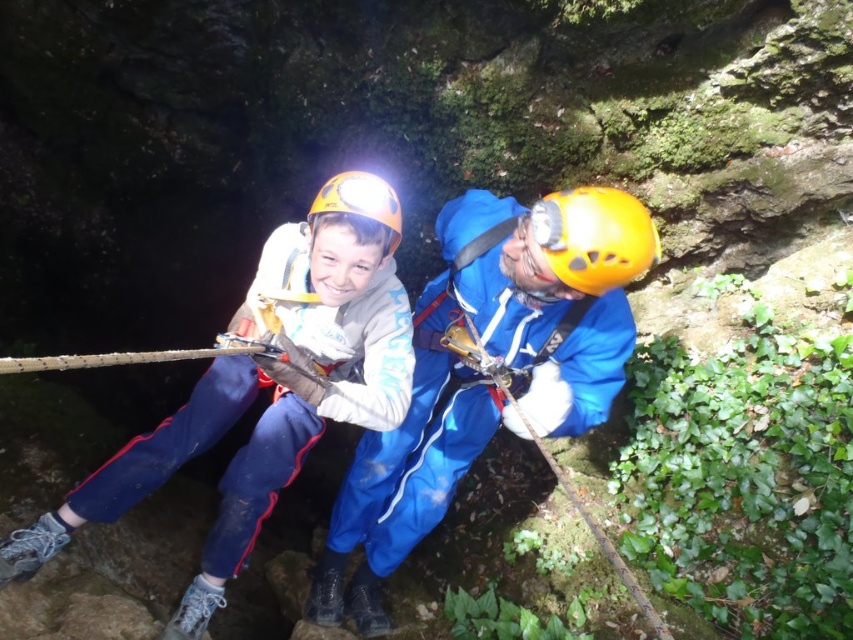
You are a safety inspector checking the gear setup of two climbers in the image. The climbers are wearing a matte blue jumpsuit at center and a matte yellow helmet at center. According to safety guidelines, the helmet must be worn above the jumpsuit. Is the current setup compliant with the safety guidelines?

The matte blue jumpsuit at center is positioned under matte yellow helmet at center, so the setup is compliant with the safety guidelines since the helmet is above the jumpsuit.

You are a safety inspector checking the gear of two climbers in the image. The blue fabric helmet at center and the matte blue jumpsuit at center are both essential for safety. Based on their heights, which gear item is more likely to interfere with the climber s vision?

The blue fabric helmet at center is much taller than the matte blue jumpsuit at center, so the blue fabric helmet at center is more likely to interfere with the climber s vision.